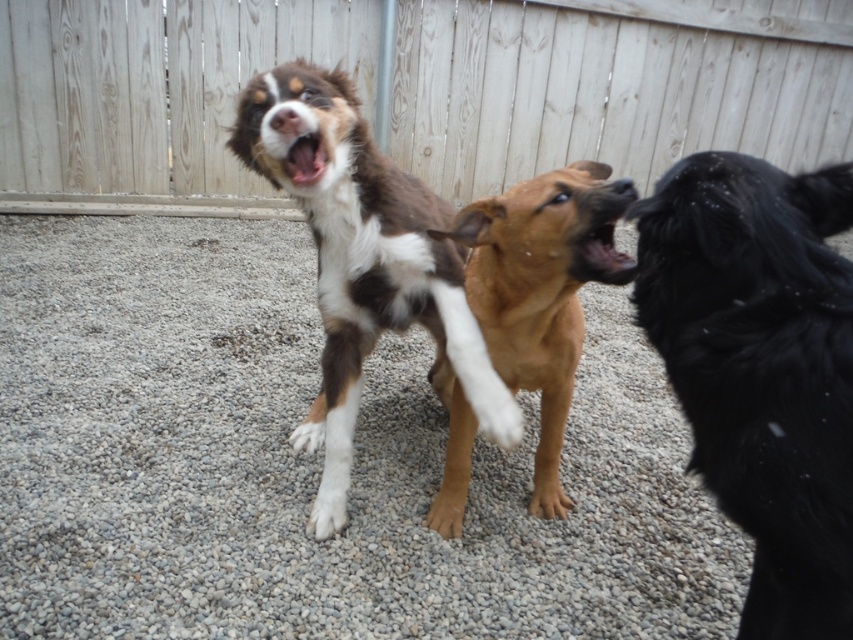
Does point (521, 420) lie behind point (548, 387)?

Yes, point (521, 420) is farther from viewer.

From the picture: Is brown and white fur dog at center bigger than brown fur paw at center?

Yes, brown and white fur dog at center is bigger than brown fur paw at center.

Is point (436, 241) positioned before point (544, 477)?

Yes, it is in front of point (544, 477).

Where is `brown and white fur dog at center`? brown and white fur dog at center is located at coordinates (364, 250).

The width and height of the screenshot is (853, 640). What do you see at coordinates (543, 278) in the screenshot? I see `brown furry dog at center` at bounding box center [543, 278].

Locate an element on the screen. brown furry dog at center is located at coordinates (543, 278).

Can you confirm if wooden fence at upper center is positioned to the right of black fluffy dog at right?

Indeed, wooden fence at upper center is positioned on the right side of black fluffy dog at right.

What do you see at coordinates (614, 84) in the screenshot?
I see `wooden fence at upper center` at bounding box center [614, 84].

Find the location of `wooden fence at upper center`. wooden fence at upper center is located at coordinates (614, 84).